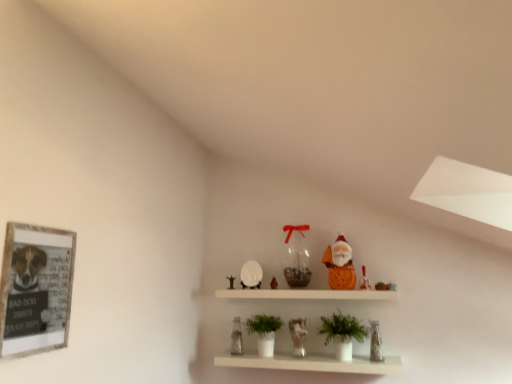
Question: Can you confirm if white matte shelf at center is positioned to the left of matte glass jar at center, which ranks as the sixth toy in right-to-left order?

Choices:
 (A) yes
 (B) no

Answer: (B)

Question: Is white matte shelf at center smaller than matte glass jar at center, which appears as the 2th toy when viewed from the left?

Choices:
 (A) no
 (B) yes

Answer: (A)

Question: Is white matte shelf at center at the right side of matte glass jar at center, which ranks as the sixth toy in right-to-left order?

Choices:
 (A) no
 (B) yes

Answer: (B)

Question: Could you tell me if white matte shelf at center is facing matte glass jar at center, which appears as the 2th toy when viewed from the left?

Choices:
 (A) yes
 (B) no

Answer: (B)

Question: From a real-world perspective, is white matte shelf at center under matte glass jar at center, which ranks as the sixth toy in right-to-left order?

Choices:
 (A) no
 (B) yes

Answer: (B)

Question: Is white matte shelf at center further to camera compared to matte glass jar at center, which appears as the 2th toy when viewed from the left?

Choices:
 (A) yes
 (B) no

Answer: (B)

Question: Can you confirm if white glossy ceramic horse at center, arranged as the fourth toy when viewed from the right, is taller than matte orange santa at upper center, which is the second toy in right-to-left order?

Choices:
 (A) no
 (B) yes

Answer: (B)

Question: Considering the relative sizes of white glossy ceramic horse at center, arranged as the fourth toy when viewed from the right, and matte orange santa at upper center, which is the second toy in right-to-left order, in the image provided, is white glossy ceramic horse at center, arranged as the fourth toy when viewed from the right, shorter than matte orange santa at upper center, which is the second toy in right-to-left order,?

Choices:
 (A) no
 (B) yes

Answer: (A)

Question: Can you confirm if white glossy ceramic horse at center, the 4th toy when ordered from left to right, is thinner than matte orange santa at upper center, positioned as the sixth toy in left-to-right order?

Choices:
 (A) no
 (B) yes

Answer: (A)

Question: Can you confirm if white glossy ceramic horse at center, arranged as the fourth toy when viewed from the right, is positioned to the right of matte orange santa at upper center, positioned as the sixth toy in left-to-right order?

Choices:
 (A) yes
 (B) no

Answer: (B)

Question: Is white glossy ceramic horse at center, arranged as the fourth toy when viewed from the right, directly adjacent to matte orange santa at upper center, which is the second toy in right-to-left order?

Choices:
 (A) no
 (B) yes

Answer: (A)

Question: Is white glossy ceramic horse at center, arranged as the fourth toy when viewed from the right, positioned with its back to matte orange santa at upper center, positioned as the sixth toy in left-to-right order?

Choices:
 (A) no
 (B) yes

Answer: (A)

Question: Is white matte shelf at center at the left side of orange fabric santa at upper center, positioned as the third toy in right-to-left order?

Choices:
 (A) yes
 (B) no

Answer: (A)